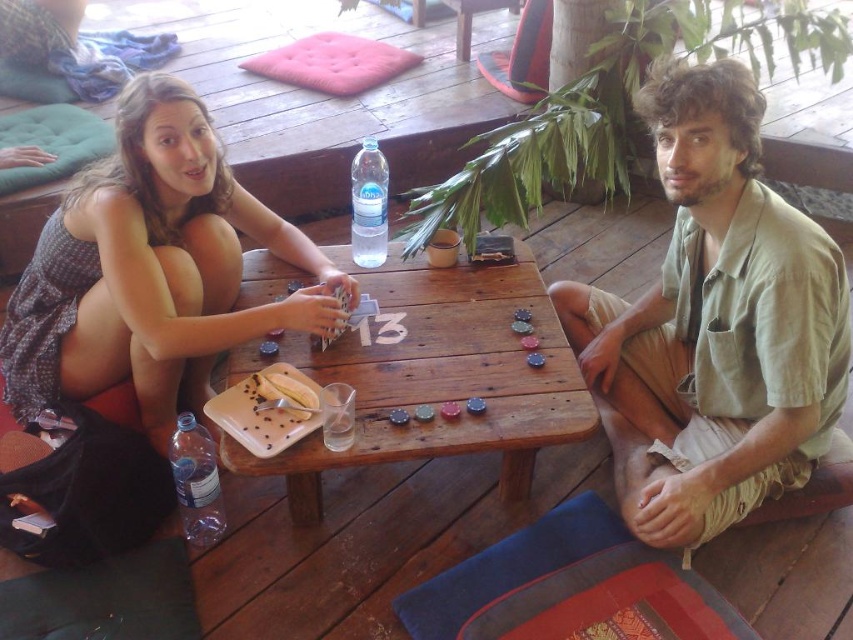
You are a photographer trying to capture a closeup of the transparent plastic bottle at lower left without including the matte black dress at upper left in the frame. Is this possible given their current positions?

The matte black dress at upper left is in front of the transparent plastic bottle at lower left, so it would block the view of the bottle. Therefore, capturing a closeup of the transparent plastic bottle at lower left without including the matte black dress at upper left is not possible.

You are standing at the point marked by coordinates point (437,378). What object are you standing on?

The point (437,378) marks the wooden table at center, so you are standing on the wooden table at center.

You are standing at the center of the image and want to place a small sticker exactly at point (714,323). Which object will the sticker land on?

The sticker will land on the green cotton shirt at upper right because the point (714,323) is located on that object.